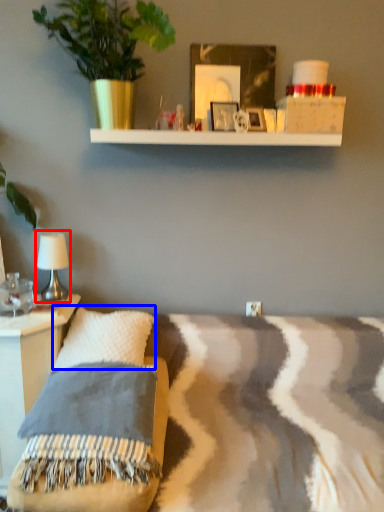
Question: Which of the following is the closest to the observer, table lamp (highlighted by a red box) or pillow (highlighted by a blue box)?

Choices:
 (A) table lamp
 (B) pillow

Answer: (B)